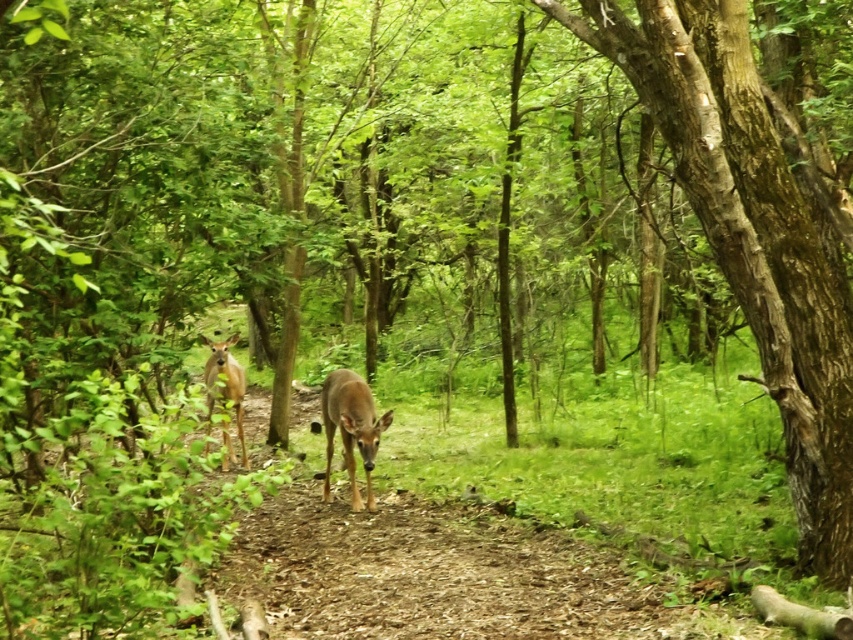
You are a photographer planning to take a photo of the smooth bark tree at center and the brown matte deer at center. Which object should you focus on first if you want to capture both in sharp focus?

The smooth bark tree at center is larger in size compared to the brown matte deer at center, so you should focus on the smooth bark tree at center first to ensure both are in sharp focus.

You are a hiker trying to locate the smooth bark tree at center in the forest. Based on the coordinates provided, can you determine its position relative to the deer?

The smooth bark tree at center is located at coordinates point (749, 234), which places it in the mid to lower section of the image, likely behind the deer positioned closer to the camera.